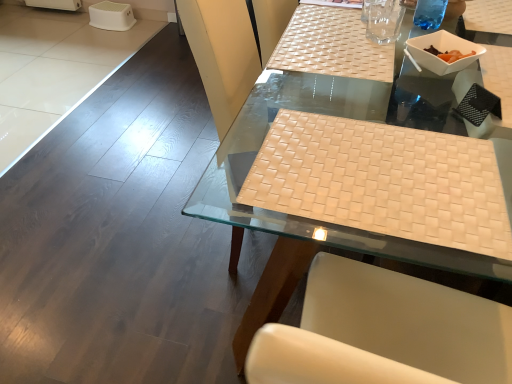
Identify the location of free point below beige woven mat at center (from a real-world perspective). The width and height of the screenshot is (512, 384). (365, 158).